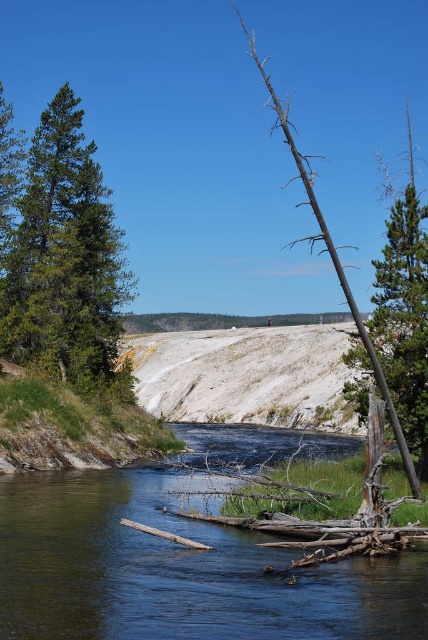
Question: Can you confirm if clear water at center is wider than brown rough bark tree at right?

Choices:
 (A) no
 (B) yes

Answer: (A)

Question: Which object is closer to the camera taking this photo?

Choices:
 (A) brown rough bark tree at right
 (B) brown dead wood at right
 (C) green matte tree at left
 (D) clear water at center

Answer: (D)

Question: Can you confirm if clear water at center is wider than green matte tree at left?

Choices:
 (A) yes
 (B) no

Answer: (A)

Question: Is green matte tree at left thinner than brown rough bark tree at right?

Choices:
 (A) no
 (B) yes

Answer: (B)

Question: Which object is farther from the camera taking this photo?

Choices:
 (A) brown dead wood at right
 (B) green matte tree at left
 (C) clear water at center

Answer: (B)

Question: Among these points, which one is farthest from the camera?

Choices:
 (A) (425, 292)
 (B) (32, 636)
 (C) (125, 276)

Answer: (C)